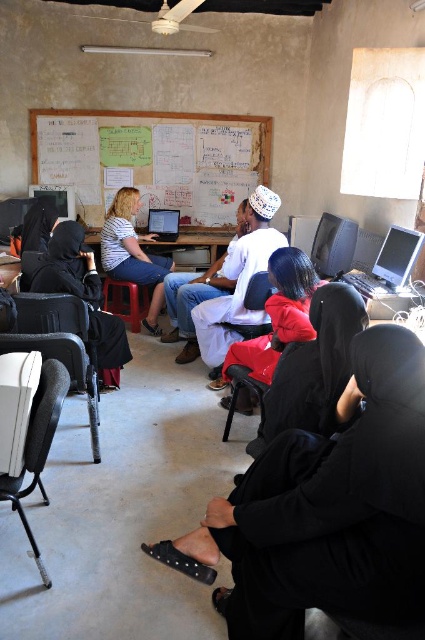
You are a participant in the computer training session and need to move from the black fabric chair at lower left to the black plastic chair at center. Which direction should you move to reach the chair?

You should move to the right to reach the black plastic chair at center because the black fabric chair at lower left is positioned on the left side of it.

From the picture: You are standing in the classroom and see the point at coordinates (238, 280). Which object is this point located on?

The point at coordinates (238, 280) is located on the white cotton shirt at center.

You are organizing a small workshop in this classroom and need to seat two participants. You have a black fabric chair at lower left and a black plastic chair at center available. Which chair would you choose if you want to accommodate a taller participant?

The black plastic chair at center has a greater width than the black fabric chair at lower left, so it would be more suitable for accommodating a taller participant.